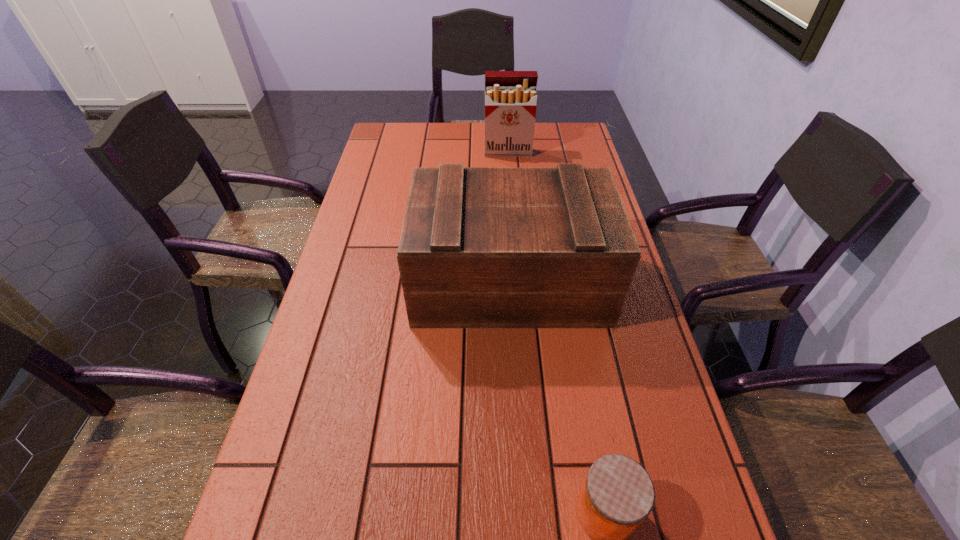
Find the location of `cigarette case`. cigarette case is located at coordinates (510, 96).

The image size is (960, 540). Identify the location of the second farthest object. (481, 247).

Locate an element on the screen. free space located with the lid open on the cigarette case is located at coordinates (510, 174).

Locate an element on the screen. vacant space situated 0.230m on the front of the second nearest object is located at coordinates (518, 421).

Where is `object at the far edge`? The width and height of the screenshot is (960, 540). object at the far edge is located at coordinates (510, 96).

Find the location of `object that is at the right edge`. object that is at the right edge is located at coordinates (481, 247).

The height and width of the screenshot is (540, 960). What are the coordinates of `vacant area at the far edge` in the screenshot? It's located at 444,130.

In the image, there is a desktop. At what (x,y) coordinates should I click in order to perform the action: click on vacant space at the left edge. Please return your answer as a coordinate pair (x, y). Looking at the image, I should click on (390, 249).

Locate an element on the screen. free space at the right edge of the desktop is located at coordinates (654, 459).

What are the coordinates of `vacant space at the far left corner of the desktop` in the screenshot? It's located at (389, 129).